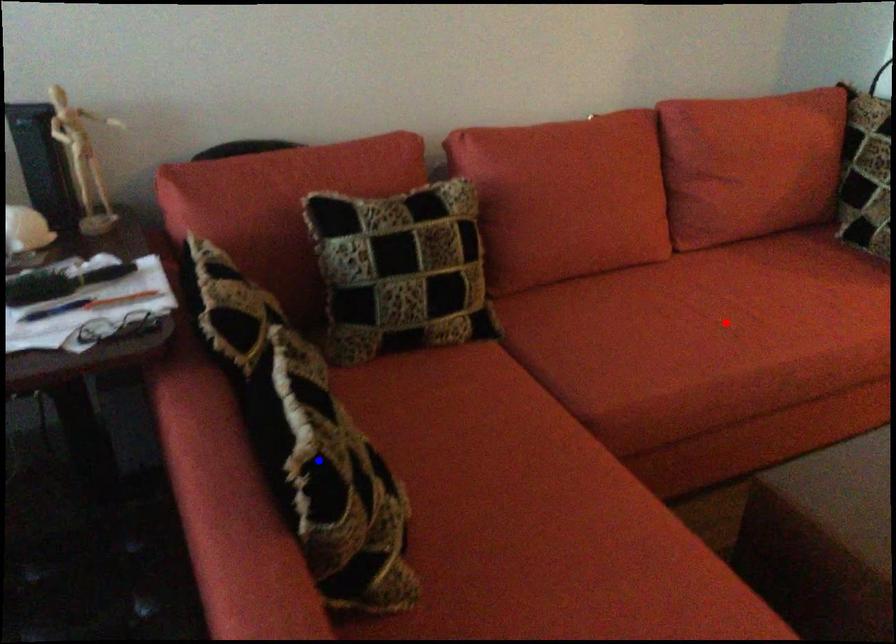
Question: Which of the two points in the image is closer to the camera?

Choices:
 (A) Blue point is closer.
 (B) Red point is closer.

Answer: (A)